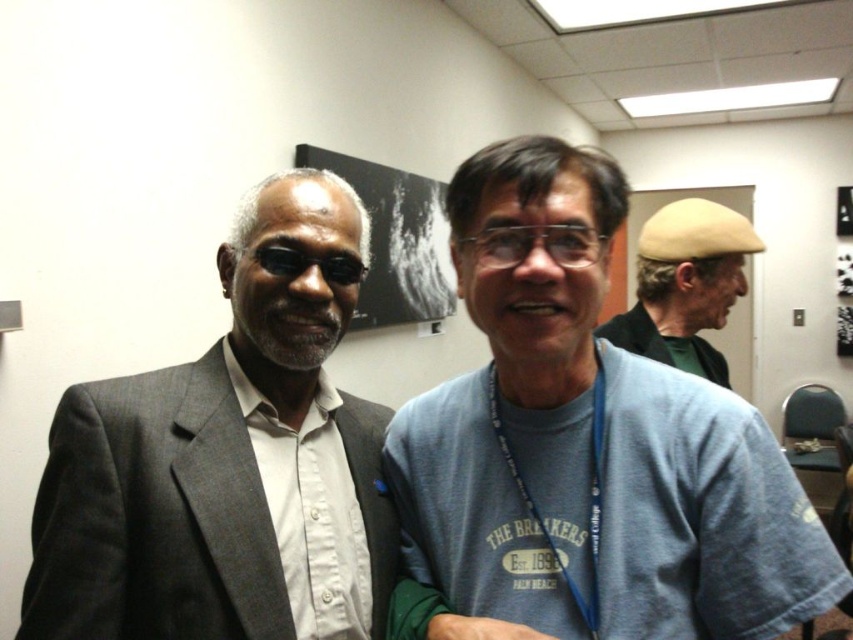
At what (x,y) coordinates should I click in order to perform the action: click on matte gray suit at left. Please return your answer as a coordinate pair (x, y). Looking at the image, I should click on (225, 460).

Does matte gray suit at left have a smaller size compared to beige felt hat at upper right?

Actually, matte gray suit at left might be larger than beige felt hat at upper right.

Locate an element on the screen. matte gray suit at left is located at coordinates (225, 460).

Is blue cotton t-shirt at center to the left of beige felt hat at upper right from the viewer's perspective?

Indeed, blue cotton t-shirt at center is positioned on the left side of beige felt hat at upper right.

Is point (693, 596) in front of point (699, 348)?

Yes, it is.

Which is in front, point (846, 586) or point (720, 220)?

Point (846, 586) is more forward.

Identify the location of blue cotton t-shirt at center. The width and height of the screenshot is (853, 640). (589, 442).

Does point (619, 474) lie behind point (358, 586)?

No.

Who is positioned more to the right, blue cotton t-shirt at center or matte gray suit at left?

blue cotton t-shirt at center

The width and height of the screenshot is (853, 640). What do you see at coordinates (589, 442) in the screenshot?
I see `blue cotton t-shirt at center` at bounding box center [589, 442].

Where is `blue cotton t-shirt at center`? The image size is (853, 640). blue cotton t-shirt at center is located at coordinates (589, 442).